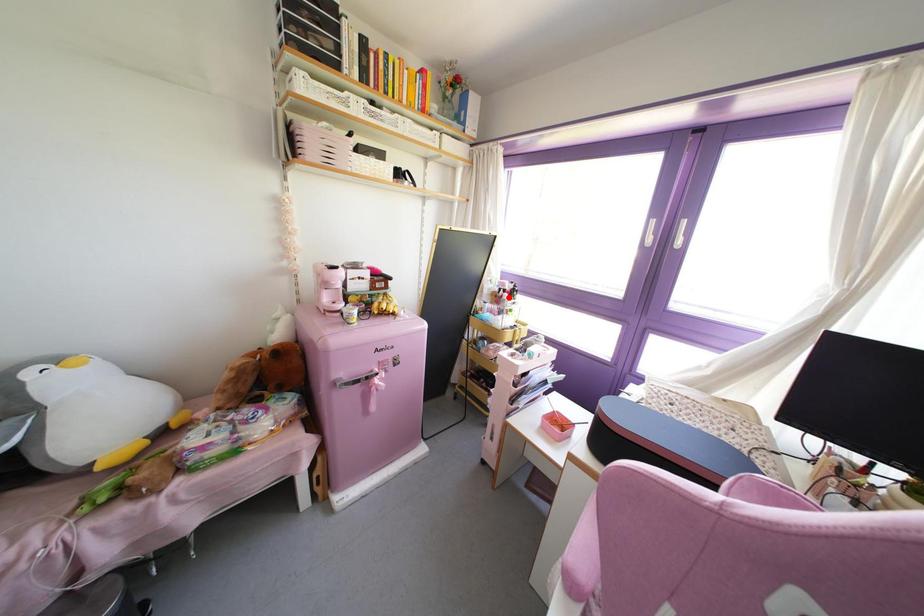
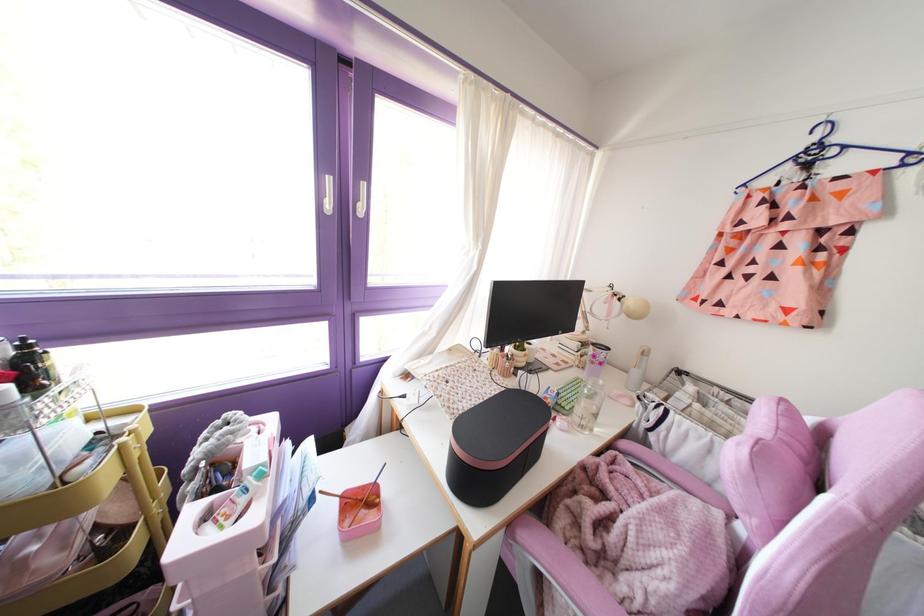
Where in the second image is the point corresponding to the highlighted location from the first image?

(32, 389)